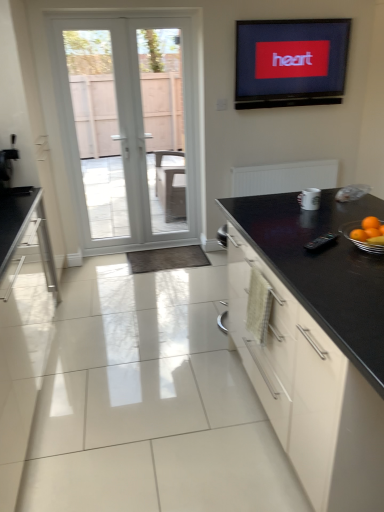
Find the location of `free space to the left of black plastic remote control at center, the first appliance positioned from the front`. free space to the left of black plastic remote control at center, the first appliance positioned from the front is located at coordinates (285, 244).